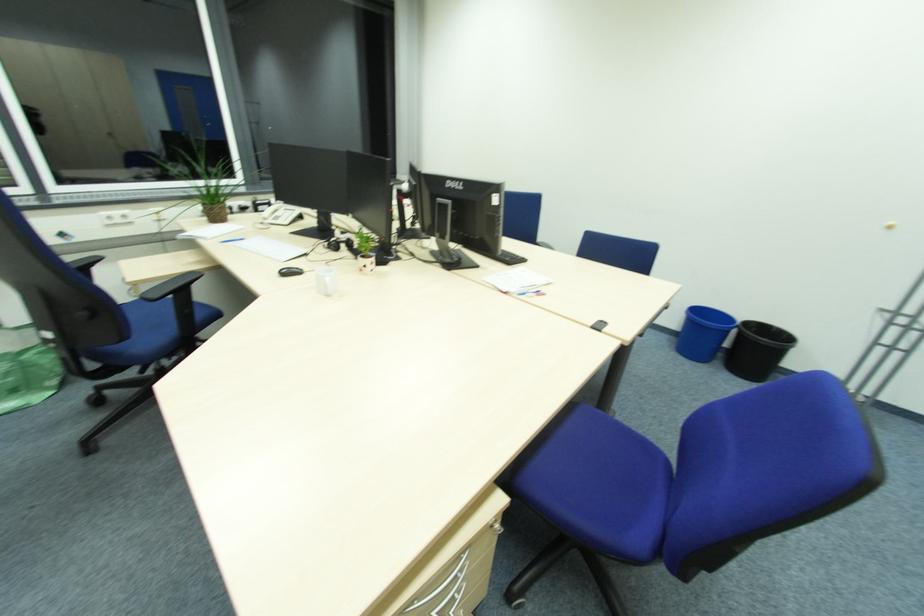
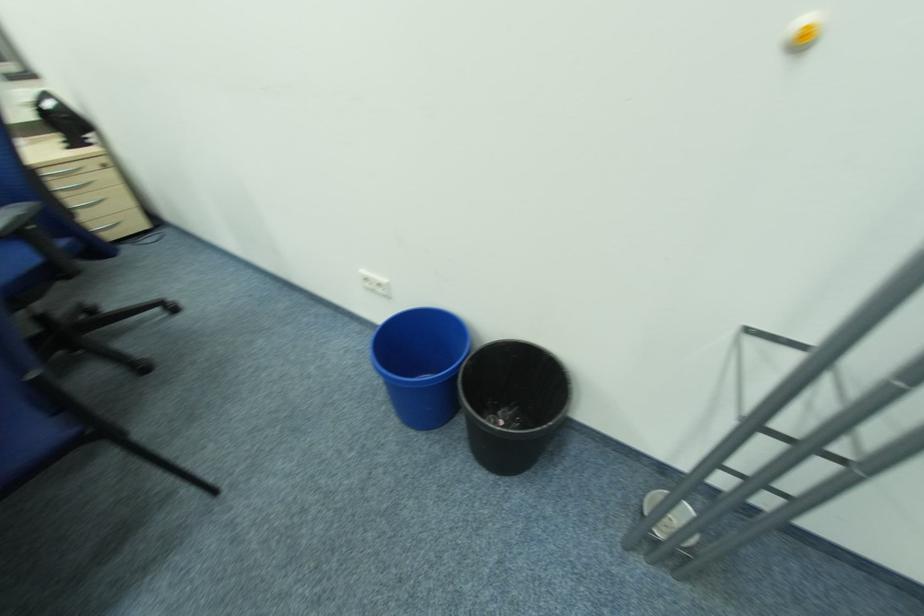
What movement of the cameraman would produce the second image?

The cameraman walked toward right, forward.